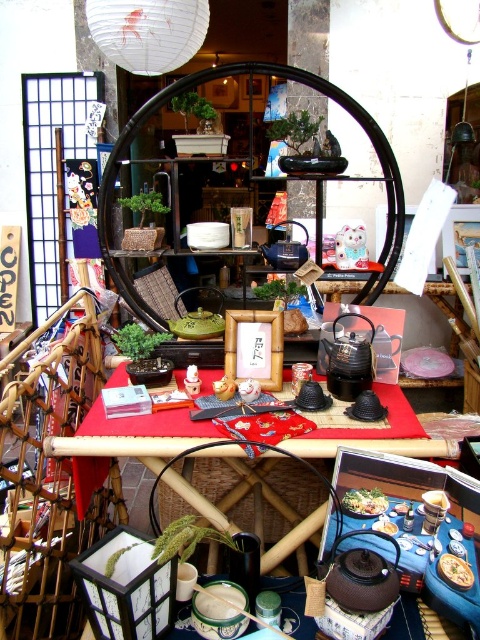
Question: Which point is farther to the camera?

Choices:
 (A) (347, 438)
 (B) (347, 509)
 (C) (272, 266)
 (D) (455, 572)

Answer: (C)

Question: Which point is farther to the camera?

Choices:
 (A) (387, 532)
 (B) (444, 570)
 (C) (274, 484)
 (D) (354, 490)

Answer: (C)

Question: Estimate the real-world distances between objects in this image. Which object is closer to the smooth white plate at center?

Choices:
 (A) matte black tea pot at center
 (B) blue ceramic teapot at center
 (C) smooth ceramic bowl at center
 (D) smooth white bowl at center

Answer: (D)

Question: Is smooth white bowl at center closer to the viewer compared to smooth white plate at center?

Choices:
 (A) no
 (B) yes

Answer: (A)

Question: Is blue ceramic teapot at center positioned in front of smooth ceramic bowl at center?

Choices:
 (A) no
 (B) yes

Answer: (A)

Question: Does dark brown matte teapot at center appear on the left side of smooth white rice at center?

Choices:
 (A) yes
 (B) no

Answer: (A)